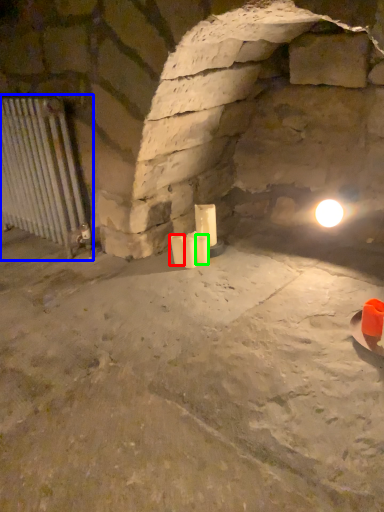
Question: Which object is positioned closest to candle (highlighted by a red box)? Select from cage (highlighted by a blue box) and candle (highlighted by a green box).

Choices:
 (A) cage
 (B) candle

Answer: (B)